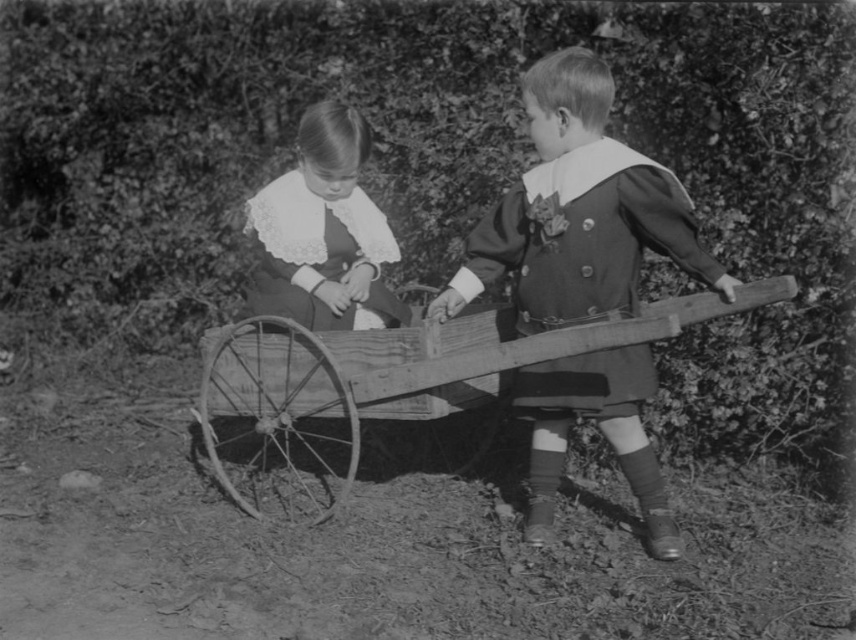
Question: Which of the following is the farthest from the observer?

Choices:
 (A) matte black dress at center
 (B) white lace dress at center

Answer: (B)

Question: Does wooden wagon at center appear on the left side of white lace dress at center?

Choices:
 (A) no
 (B) yes

Answer: (A)

Question: Is wooden cart at center wider than white lace dress at center?

Choices:
 (A) no
 (B) yes

Answer: (A)

Question: Considering the real-world distances, which object is closest to the smooth wood plank at right?

Choices:
 (A) matte black dress at center
 (B) wooden cart at center
 (C) white lace dress at center
 (D) wooden wagon at center

Answer: (A)

Question: Among these points, which one is farthest from the camera?

Choices:
 (A) (617, 298)
 (B) (316, 305)
 (C) (485, 237)
 (D) (3, 157)

Answer: (D)

Question: Is wooden wagon at center to the right of matte black dress at center from the viewer's perspective?

Choices:
 (A) yes
 (B) no

Answer: (B)